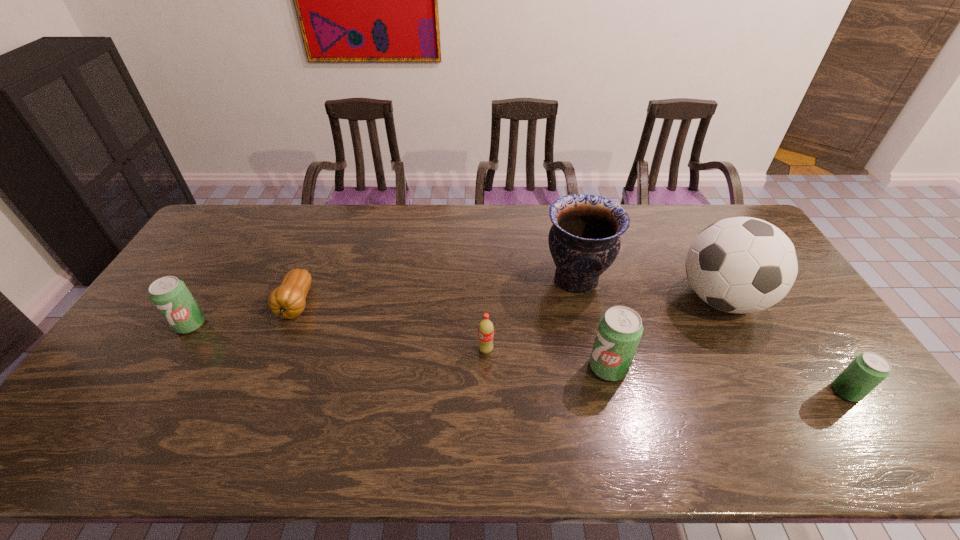
Where is `the farthest soda`? the farthest soda is located at coordinates (170, 295).

In order to click on the leftmost soda in this screenshot , I will do `click(170, 295)`.

Identify the location of the tallest soda. (620, 329).

In order to click on the fifth shortest object in this screenshot , I will do `click(620, 329)`.

The height and width of the screenshot is (540, 960). Identify the location of the rightmost soda. (869, 369).

In order to click on the shortest object in this screenshot , I will do `click(287, 301)`.

Where is `the sixth object from right to left`? the sixth object from right to left is located at coordinates (287, 301).

Where is `the second object from right to left`? The image size is (960, 540). the second object from right to left is located at coordinates (x=741, y=265).

Where is `pottery`? pottery is located at coordinates (584, 240).

Identify the location of the third soda from right to left. (486, 328).